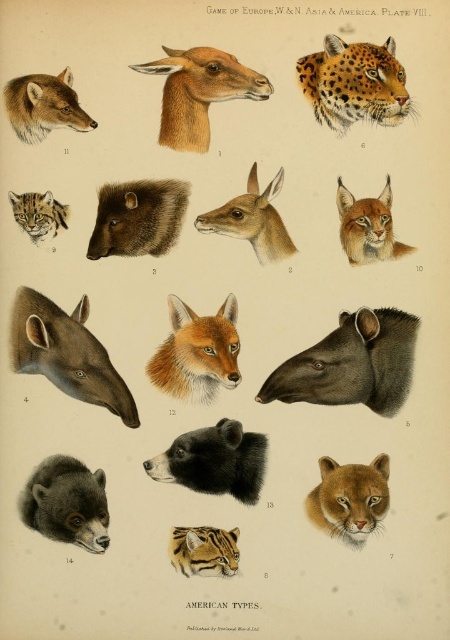
Question: Considering the real-world distances, which object is closest to the brown fur antelope head at upper center?

Choices:
 (A) brown fur fox at center
 (B) golden fur cat at center
 (C) striped fur tiger at center
 (D) spotted fur leopard at upper right

Answer: (D)

Question: Which point appears closest to the camera in this image?

Choices:
 (A) (53, 208)
 (B) (373, 381)
 (C) (117, 218)
 (D) (274, 220)

Answer: (B)

Question: Considering the real-world distances, which object is closest to the spotted fur cat at upper left?

Choices:
 (A) black fur bear at center
 (B) dark brown fur bear at lower left

Answer: (B)

Question: Can you confirm if golden fur cat at center is positioned to the right of brown fur lynx at upper right?

Choices:
 (A) no
 (B) yes

Answer: (A)

Question: Is green matte tapir head at center-right thinner than brown furry animal at center-left?

Choices:
 (A) yes
 (B) no

Answer: (B)

Question: From the image, what is the correct spatial relationship of green matte tapir head at center-right in relation to brown matte tapir head at center-left?

Choices:
 (A) above
 (B) below

Answer: (B)